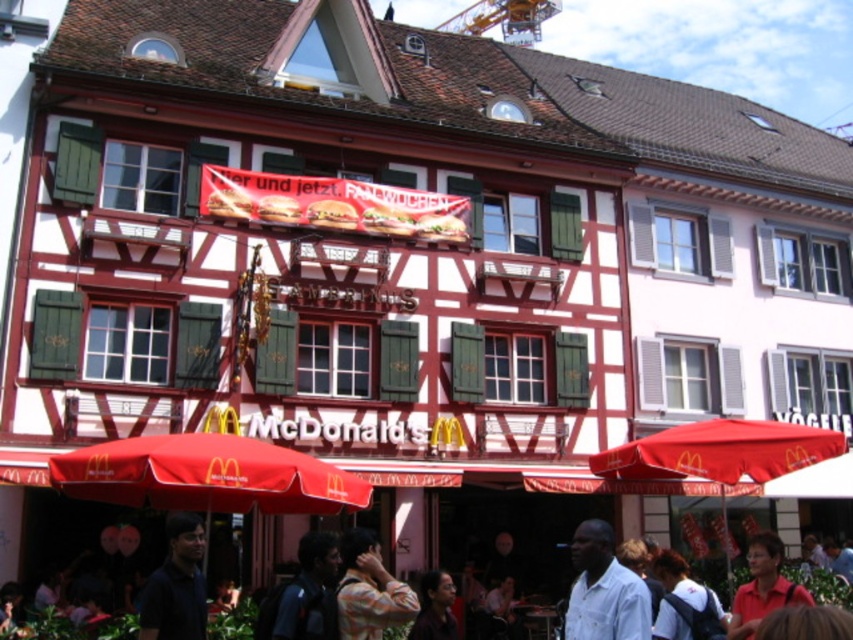
Question: Which object is closer to the camera taking this photo?

Choices:
 (A) red fabric umbrella at lower right
 (B) white cotton shirt at center
 (C) plaid shirt at center
 (D) matte red shirt at lower right

Answer: (B)

Question: Does dark blue shirt at lower center appear under matte black glasses at center?

Choices:
 (A) no
 (B) yes

Answer: (A)

Question: Does white cotton shirt at center have a greater width compared to dark blue shirt at lower left?

Choices:
 (A) yes
 (B) no

Answer: (B)

Question: Among these objects, which one is farthest from the camera?

Choices:
 (A) white cotton shirt at center
 (B) yellow metallic crane at upper center
 (C) dark blue shirt at lower center

Answer: (B)

Question: Which object appears farthest from the camera in this image?

Choices:
 (A) dark blue shirt at lower center
 (B) white fabric backpack at lower right
 (C) matte red shirt at lower right

Answer: (B)

Question: Does dark blue shirt at lower center lie in front of yellow metallic crane at upper center?

Choices:
 (A) no
 (B) yes

Answer: (B)